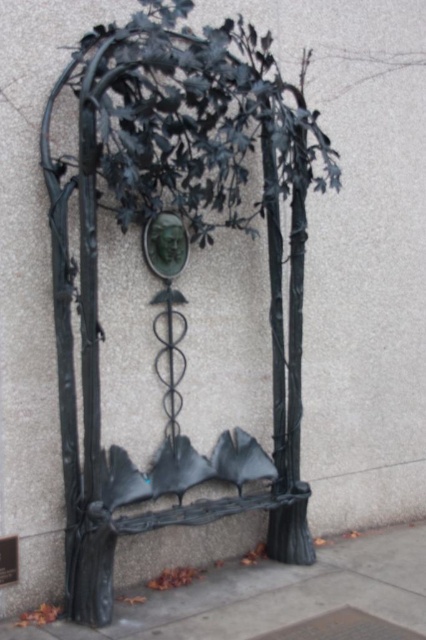
Question: Can you confirm if black wrought iron tree at center is positioned below smooth concrete pavement at lower center?

Choices:
 (A) no
 (B) yes

Answer: (A)

Question: Which is farther from the black matte plaque at lower left?

Choices:
 (A) smooth concrete pavement at lower center
 (B) black wrought iron tree at center

Answer: (B)

Question: Where is black wrought iron tree at center located in relation to smooth concrete pavement at lower center in the image?

Choices:
 (A) left
 (B) right

Answer: (A)

Question: Which of the following is the closest to the observer?

Choices:
 (A) (0, 557)
 (B) (296, 598)
 (C) (60, 336)
 (D) (167, 214)

Answer: (A)

Question: Which object appears closest to the camera in this image?

Choices:
 (A) green patina mask at center
 (B) smooth concrete pavement at lower center
 (C) black matte plaque at lower left

Answer: (B)

Question: Does green patina mask at center appear on the left side of black matte plaque at lower left?

Choices:
 (A) yes
 (B) no

Answer: (B)